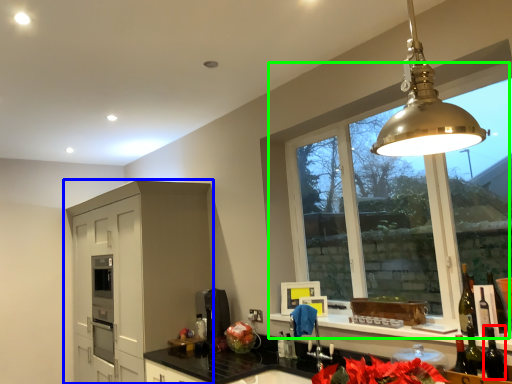
Question: Which object is the closest to the wine bottle (highlighted by a red box)? Choose among these: cabinetry (highlighted by a blue box) or window (highlighted by a green box).

Choices:
 (A) cabinetry
 (B) window

Answer: (B)